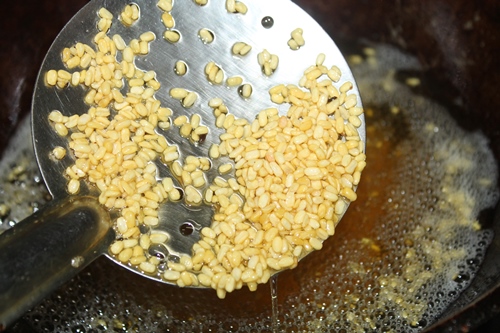
Identify the location of handle. (42, 264).